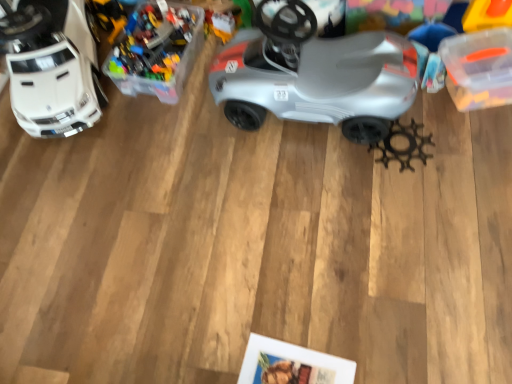
Question: Does point (166, 23) appear closer or farther from the camera than point (44, 82)?

Choices:
 (A) farther
 (B) closer

Answer: (A)

Question: From their relative heights in the image, would you say translucent plastic container at upper left, acting as the second toy starting from the left, is taller or shorter than white plastic car at left, the 1th toy when ordered from left to right?

Choices:
 (A) short
 (B) tall

Answer: (A)

Question: Estimate the real-world distances between objects in this image. Which object is farther from the white plastic car at left, the 1th toy when ordered from left to right?

Choices:
 (A) metallic gear at lower right, the 3th toy viewed from the left
 (B) silver matte car at center
 (C) translucent plastic container at upper left, acting as the second toy starting from the left

Answer: (A)

Question: Which object is positioned closest to the metallic gear at lower right, the 3th toy viewed from the left?

Choices:
 (A) white plastic car at left, the 3th toy in the right-to-left sequence
 (B) silver matte car at center
 (C) translucent plastic container at upper left, the 2th toy positioned from the right

Answer: (B)